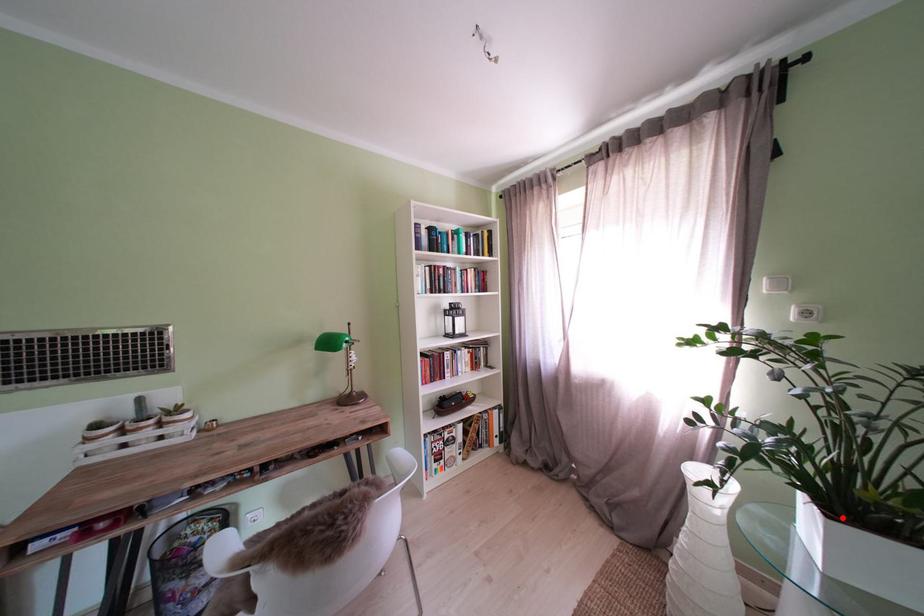
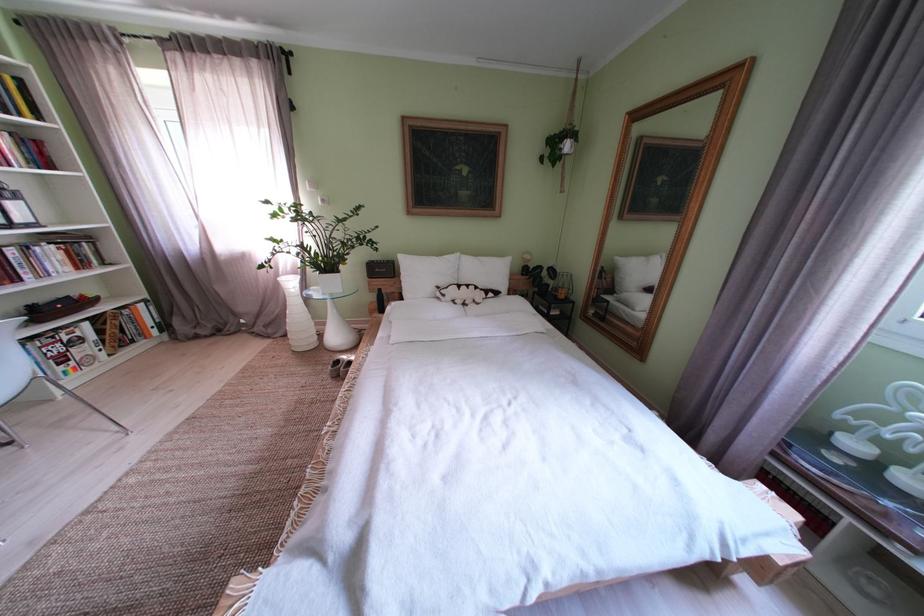
Question: A red point is marked in image1. In image2, is the corresponding 3D point closer to the camera or farther? Reply with the corresponding letter.

Choices:
 (A) The corresponding 3D point is closer.
 (B) The corresponding 3D point is farther.

Answer: (B)